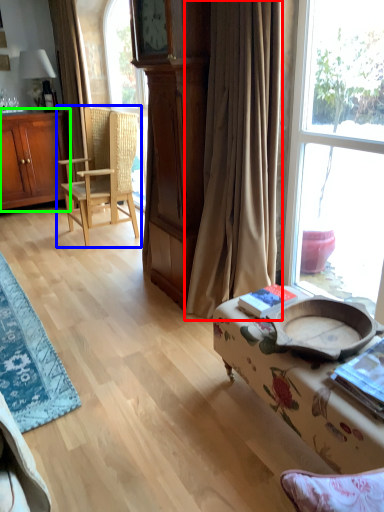
Question: Estimate the real-world distances between objects in this image. Which object is closer to curtain (highlighted by a red box), chair (highlighted by a blue box) or cabinetry (highlighted by a green box)?

Choices:
 (A) chair
 (B) cabinetry

Answer: (A)